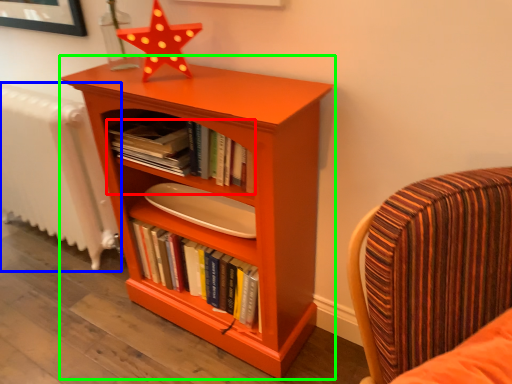
Question: Which object is the closest to the book (highlighted by a red box)? Choose among these: radiator (highlighted by a blue box) or bookcase (highlighted by a green box).

Choices:
 (A) radiator
 (B) bookcase

Answer: (B)